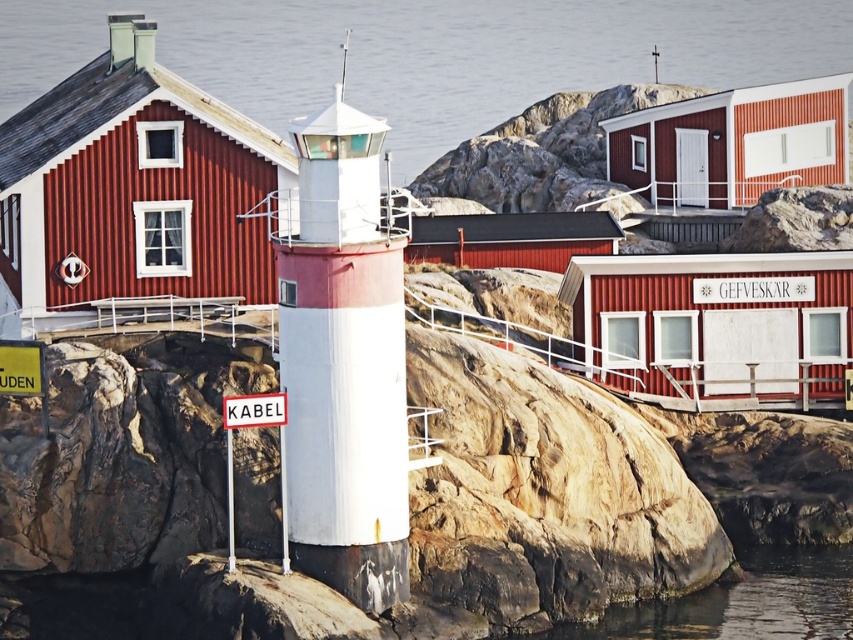
Question: Among these points, which one is nearest to the camera?

Choices:
 (A) (766, 282)
 (B) (280, 406)
 (C) (25, 358)
 (D) (109, 115)

Answer: (B)

Question: Is rustic corrugated metal hut at upper left closer to camera compared to yellow paper at lower left?

Choices:
 (A) yes
 (B) no

Answer: (B)

Question: Which point is farther to the camera?

Choices:
 (A) (798, 285)
 (B) (567, 58)

Answer: (B)

Question: Which object is the farthest from the matte red wooden hut at center right?

Choices:
 (A) matte red wooden hut at center
 (B) white wooden sign at center

Answer: (A)

Question: Can you confirm if white wooden sign at center is positioned to the right of white plastic sign at center?

Choices:
 (A) yes
 (B) no

Answer: (A)

Question: Where is transparent water at center located in relation to matte red wooden hut at center in the image?

Choices:
 (A) right
 (B) left

Answer: (A)